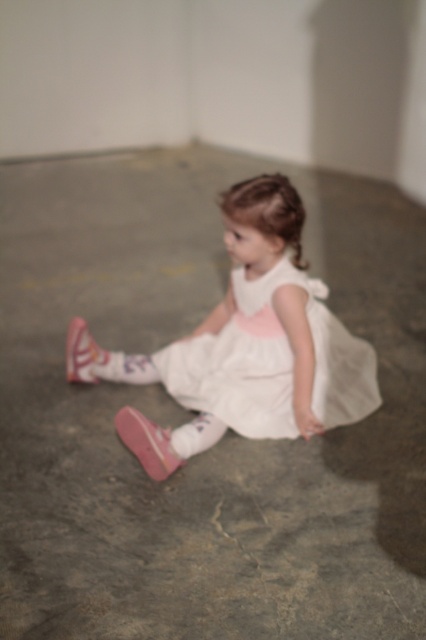
The image size is (426, 640). Identify the location of pink suede sneaker at lower left. (146, 442).

Which is behind, point (164, 438) or point (187, 428)?

The point (187, 428) is behind.

Where is `pink suede sneaker at lower left`? pink suede sneaker at lower left is located at coordinates (146, 442).

What do you see at coordinates (270, 332) in the screenshot? I see `pink fabric dress at center` at bounding box center [270, 332].

Is pink fabric dress at center positioned in front of pink suede sneaker at lower left?

No.

Is point (264, 208) farther from viewer compared to point (147, 460)?

Yes, point (264, 208) is farther from viewer.

The image size is (426, 640). I want to click on pink fabric dress at center, so click(270, 332).

Between white satin dress at center and pink fabric sock at lower center, which one is positioned lower?

Positioned lower is pink fabric sock at lower center.

Who is taller, white satin dress at center or pink fabric sock at lower center?

white satin dress at center

Where is `white satin dress at center`? white satin dress at center is located at coordinates (x=270, y=362).